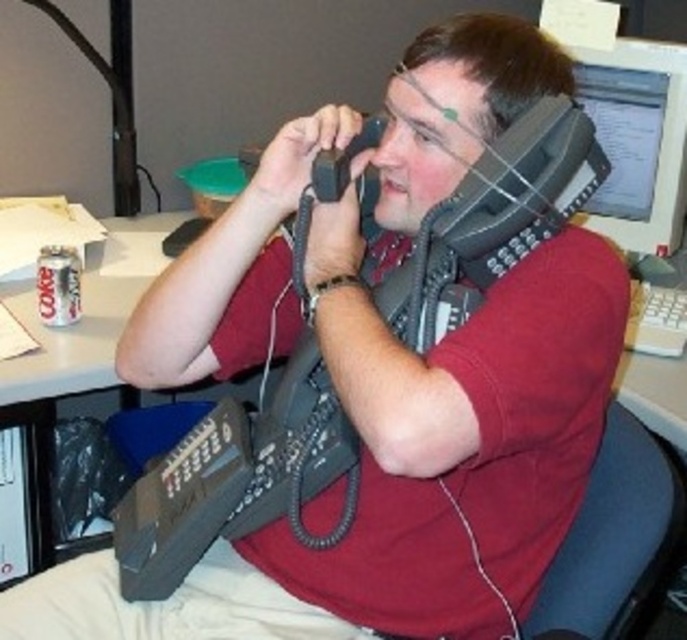
You are a delivery person who needs to place a new monitor on the desk. The new monitor is 32 inches wide. There is currently a matte plastic monitor at upper right and a black rubber earphone at upper center on the desk. Can the new monitor fit between these two items without overlapping them?

The distance between the matte plastic monitor at upper right and the black rubber earphone at upper center is 33.10 inches. Since the new monitor is 32 inches wide, it can fit between them as the available space is slightly larger than the monitor.

You are standing at the origin of a coordinate system placed at the bottom left corner of the desk. You see two points labeled as point (600,104) and point (444,113). Which point is closer to the back edge of the desk?

Point (600,104) is behind point (444,113), so it is closer to the back edge of the desk.

You are a delivery person who just arrived at this office. You need to place a new monitor on the desk. Where should you put it so it doesn not block the existing matte plastic monitor at upper right?

Place the new monitor away from the area at point (638, 140) where the existing matte plastic monitor at upper right is located.